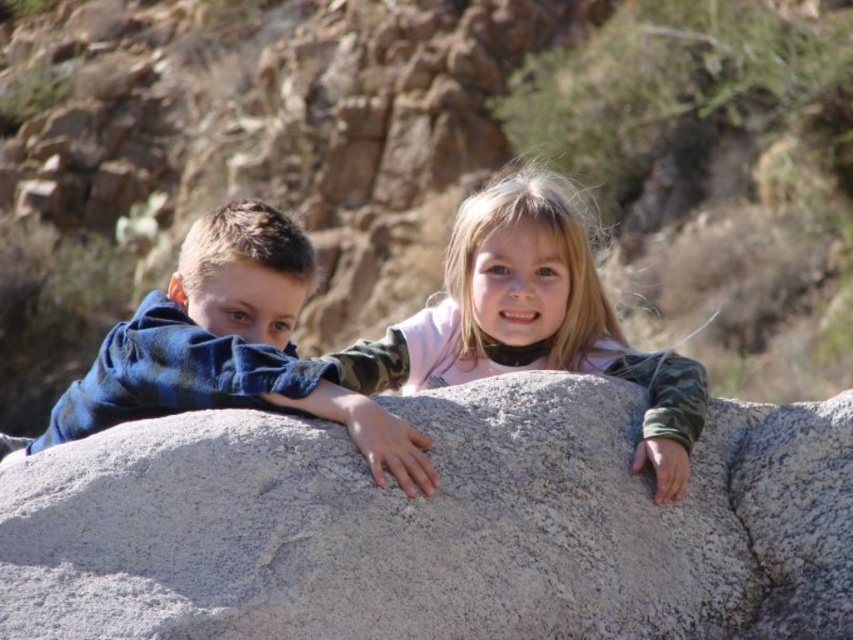
Question: Estimate the real-world distances between objects in this image. Which object is farther from the blue denim jacket at left?

Choices:
 (A) light pink fabric at center
 (B) gray rough rock at center

Answer: (A)

Question: Estimate the real-world distances between objects in this image. Which object is farther from the blue denim jacket at left?

Choices:
 (A) light pink fabric at center
 (B) gray rough rock at center

Answer: (A)

Question: Among these points, which one is farthest from the camera?

Choices:
 (A) (321, 396)
 (B) (587, 288)
 (C) (326, 572)

Answer: (B)

Question: Can you confirm if light pink fabric at center is positioned to the right of blue denim jacket at left?

Choices:
 (A) yes
 (B) no

Answer: (A)

Question: Can you confirm if light pink fabric at center is positioned to the left of blue denim jacket at left?

Choices:
 (A) no
 (B) yes

Answer: (A)

Question: Can you confirm if gray rough rock at center is positioned below light pink fabric at center?

Choices:
 (A) yes
 (B) no

Answer: (A)